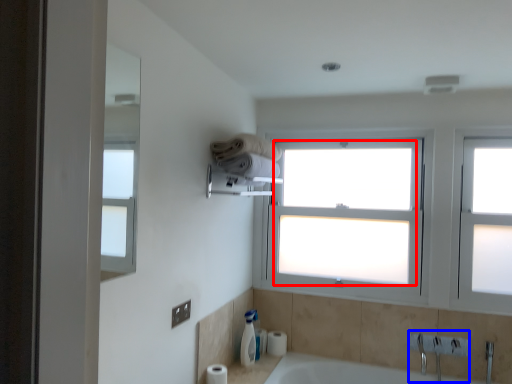
Question: Which of the following is the farthest to the observer, window screen (highlighted by a red box) or sink (highlighted by a blue box)?

Choices:
 (A) window screen
 (B) sink

Answer: (A)